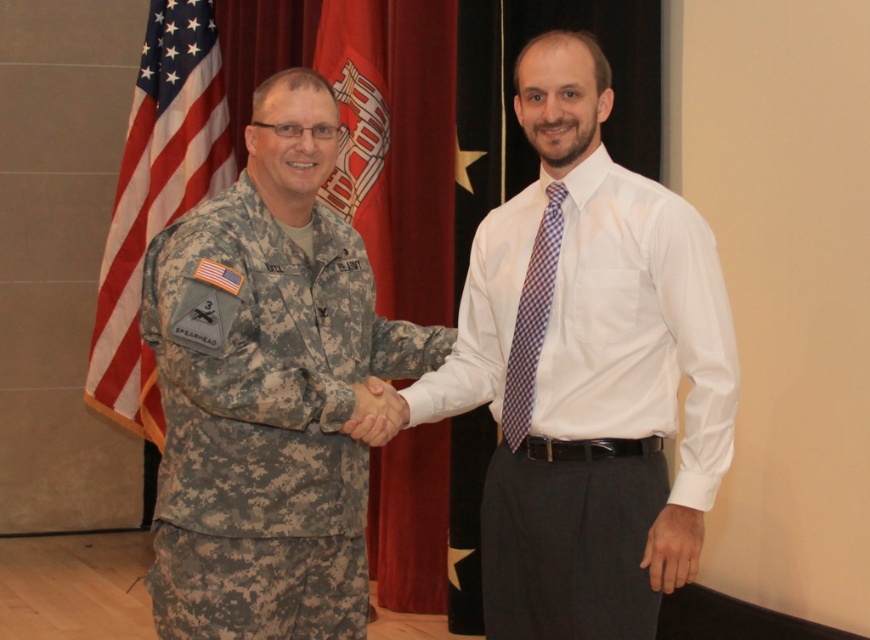
Who is higher up, red fabric flag at center or american flag at left?

red fabric flag at center

Who is more distant from viewer, [377,58] or [139,164]?

Point [139,164]

Does point (429, 33) come behind point (179, 81)?

No.

The width and height of the screenshot is (870, 640). Identify the location of red fabric flag at center. (395, 144).

Is white glossy shirt at center smaller than purple checkered tie at center?

No.

The height and width of the screenshot is (640, 870). What do you see at coordinates (587, 371) in the screenshot? I see `white glossy shirt at center` at bounding box center [587, 371].

The width and height of the screenshot is (870, 640). What are the coordinates of `white glossy shirt at center` in the screenshot? It's located at (587, 371).

Who is taller, white glossy shirt at center or camouflage fabric uniform at center?

white glossy shirt at center is taller.

Describe the element at coordinates (587, 371) in the screenshot. The width and height of the screenshot is (870, 640). I see `white glossy shirt at center` at that location.

What do you see at coordinates (587, 371) in the screenshot? The image size is (870, 640). I see `white glossy shirt at center` at bounding box center [587, 371].

I want to click on white glossy shirt at center, so click(587, 371).